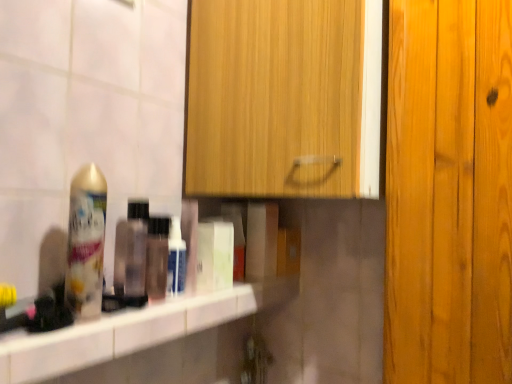
Question: From the image's perspective, is gold metallic can at left located above or below wooden cabinet at upper center?

Choices:
 (A) below
 (B) above

Answer: (A)

Question: Based on their positions, is gold metallic can at left located to the left or right of wooden cabinet at upper center?

Choices:
 (A) right
 (B) left

Answer: (B)

Question: Which is nearer to the translucent plastic bottle at shelf, marked as the 2th mouthwash in a right-to-left arrangement?

Choices:
 (A) white glossy counter top at center
 (B) translucent plastic bottle at center
 (C) white glossy bottle at center, the 1th mouthwash from the right
 (D) gold metallic can at left
 (E) wooden cabinet at upper center

Answer: (B)

Question: Which object is the farthest from the translucent plastic bottle at center?

Choices:
 (A) white glossy counter top at center
 (B) white glossy bottle at center, arranged as the 2th mouthwash when viewed from the left
 (C) translucent plastic bottle at shelf, the first mouthwash in the left-to-right sequence
 (D) wooden cabinet at upper center
 (E) gold metallic can at left

Answer: (D)